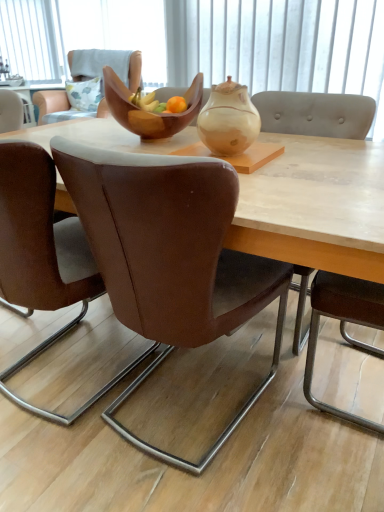
In order to face brown leather chair at center, which appears as the 1th chair when viewed from the back, should I rotate leftwards or rightwards?

Turn left by 13.414 degrees to look at brown leather chair at center, which appears as the 1th chair when viewed from the back.

Locate an element on the screen. brown leather chair at center, the 4th chair viewed from the front is located at coordinates (107, 64).

The width and height of the screenshot is (384, 512). Describe the element at coordinates (43, 257) in the screenshot. I see `brown leather chair at center, which is the 2th chair from back to front` at that location.

You are a GUI agent. You are given a task and a screenshot of the screen. Output one action in this format:
    pyautogui.click(x=<x>, y=<y>)
    Task: Click on the wooden bowl at center
    
    Given the screenshot: What is the action you would take?
    pyautogui.click(x=151, y=112)

This screenshot has width=384, height=512. What do you see at coordinates (84, 94) in the screenshot?
I see `fluffy fabric pillow at upper left` at bounding box center [84, 94].

What is the approximate height of brown leather chair at center, marked as the first chair in a front-to-back arrangement?

36.78 inches.

Locate an element on the screen. brown leather chair at center, which appears as the 1th chair when viewed from the back is located at coordinates (107, 64).

Could you tell me if light gray fabric chair at right, the 3th chair when ordered from back to front, is turned towards wooden bowl at center?

Yes, light gray fabric chair at right, the 3th chair when ordered from back to front, is facing wooden bowl at center.

From the image's perspective, which object appears higher, light gray fabric chair at right, which appears as the 2th chair when viewed from the front, or wooden bowl at center?

wooden bowl at center.

Considering the sizes of objects light gray fabric chair at right, which appears as the 2th chair when viewed from the front, and wooden bowl at center in the image provided, who is thinner, light gray fabric chair at right, which appears as the 2th chair when viewed from the front, or wooden bowl at center?

light gray fabric chair at right, which appears as the 2th chair when viewed from the front, is thinner.

Which object is positioned more to the left, light gray fabric chair at right, the 3th chair when ordered from back to front, or wooden bowl at center?

wooden bowl at center.

How different are the orientations of brown leather chair at center, marked as the first chair in a front-to-back arrangement, and wooden bowl at center in degrees?

brown leather chair at center, marked as the first chair in a front-to-back arrangement, and wooden bowl at center are facing 178 degrees away from each other.

In the scene shown: Is brown leather chair at center, acting as the 4th chair starting from the back, bigger than wooden bowl at center?

No.

In the scene shown: Which is more to the right, brown leather chair at center, acting as the 4th chair starting from the back, or wooden bowl at center?

From the viewer's perspective, brown leather chair at center, acting as the 4th chair starting from the back, appears more on the right side.

Looking at this image, in the image, is brown leather chair at center, marked as the first chair in a front-to-back arrangement, positioned in front of or behind wooden bowl at center?

Clearly, brown leather chair at center, marked as the first chair in a front-to-back arrangement, is behind wooden bowl at center.

Visually, is matte beige teapot at center positioned to the left or to the right of brown leather chair at center, acting as the 4th chair starting from the back?

In the image, matte beige teapot at center appears on the right side of brown leather chair at center, acting as the 4th chair starting from the back.

Is matte beige teapot at center directly adjacent to brown leather chair at center, acting as the 4th chair starting from the back?

No, matte beige teapot at center is not in contact with brown leather chair at center, acting as the 4th chair starting from the back.

Is matte beige teapot at center looking in the opposite direction of brown leather chair at center, acting as the 4th chair starting from the back?

No, matte beige teapot at center's orientation is not away from brown leather chair at center, acting as the 4th chair starting from the back.

Is point (249, 145) positioned behind point (98, 185)?

Yes, point (249, 145) is behind point (98, 185).

Looking at this image, between white fabric at upper center and brown leather chair at center, marked as the first chair in a front-to-back arrangement, which one has smaller width?

Thinner between the two is white fabric at upper center.

Is white fabric at upper center turned away from brown leather chair at center, marked as the first chair in a front-to-back arrangement?

No, white fabric at upper center is not facing the opposite direction of brown leather chair at center, marked as the first chair in a front-to-back arrangement.

Which is more to the left, white fabric at upper center or brown leather chair at center, marked as the first chair in a front-to-back arrangement?

From the viewer's perspective, white fabric at upper center appears more on the left side.

From the picture: From a real-world perspective, is white fabric at upper center positioned under brown leather chair at center, marked as the first chair in a front-to-back arrangement, based on gravity?

No, from a real-world perspective, white fabric at upper center is not below brown leather chair at center, marked as the first chair in a front-to-back arrangement.

Considering the relative positions of brown leather chair at center, which appears as the 1th chair when viewed from the back, and light gray fabric chair at right, which appears as the 2th chair when viewed from the front, in the image provided, is brown leather chair at center, which appears as the 1th chair when viewed from the back, in front of light gray fabric chair at right, which appears as the 2th chair when viewed from the front,?

No, brown leather chair at center, which appears as the 1th chair when viewed from the back, is further to the viewer.

The height and width of the screenshot is (512, 384). In order to click on the 3rd chair counting from the left of the light gray fabric chair at right, the 3th chair when ordered from back to front in this screenshot , I will do `click(107, 64)`.

How different are the orientations of brown leather chair at center, the 4th chair viewed from the front, and light gray fabric chair at right, which appears as the 2th chair when viewed from the front, in degrees?

There is a 93.6-degree angle between the facing directions of brown leather chair at center, the 4th chair viewed from the front, and light gray fabric chair at right, which appears as the 2th chair when viewed from the front.

Is brown leather chair at center, which appears as the 1th chair when viewed from the back, completely or partially outside of light gray fabric chair at right, which appears as the 2th chair when viewed from the front?

Absolutely, brown leather chair at center, which appears as the 1th chair when viewed from the back, is external to light gray fabric chair at right, which appears as the 2th chair when viewed from the front.

Would you say wooden bowl at center is outside white fabric at upper center?

Yes, wooden bowl at center is not within white fabric at upper center.

Based on the photo, considering the sizes of objects wooden bowl at center and white fabric at upper center in the image provided, who is thinner, wooden bowl at center or white fabric at upper center?

With smaller width is white fabric at upper center.

Which point is more forward, (x=126, y=108) or (x=20, y=6)?

The point (x=126, y=108) is closer to the camera.

Based on the photo, is wooden bowl at center taller than white fabric at upper center?

In fact, wooden bowl at center may be shorter than white fabric at upper center.

Which is nearer, (229, 78) or (2, 18)?

Clearly, point (229, 78) is closer to the camera than point (2, 18).

Is the depth of matte beige teapot at center greater than that of white fabric at upper center?

No, it is in front of white fabric at upper center.

From the image's perspective, is matte beige teapot at center under white fabric at upper center?

Yes, from the image's perspective, matte beige teapot at center is beneath white fabric at upper center.

Is matte beige teapot at center facing towards white fabric at upper center?

No.

Locate an element on the screen. The image size is (384, 512). the 2nd chair behind the wooden bowl at center, starting your count from the anchor is located at coordinates (315, 114).

I want to click on the 1st chair to the right of the wooden bowl at center, starting your count from the anchor, so click(170, 258).

When comparing their distances from wooden bowl at center, does brown leather chair at center, which is the 2th chair from back to front, or matte beige teapot at center seem closer?

matte beige teapot at center lies closer to wooden bowl at center than the other object.

When comparing their distances from fluffy fabric pillow at upper left, does light gray fabric chair at right, the 3th chair when ordered from back to front, or brown leather chair at center, which is the 2th chair from back to front, seem closer?

light gray fabric chair at right, the 3th chair when ordered from back to front, is closer to fluffy fabric pillow at upper left.

When comparing their distances from wooden bowl at center, does fluffy fabric pillow at upper left or brown leather chair at center, which is the 2th chair from back to front, seem closer?

Among the two, brown leather chair at center, which is the 2th chair from back to front, is located nearer to wooden bowl at center.

Considering their positions, is fluffy fabric pillow at upper left positioned further to brown leather chair at center, which is the 2th chair from back to front, than wooden bowl at center?

The object further to brown leather chair at center, which is the 2th chair from back to front, is fluffy fabric pillow at upper left.

When comparing their distances from light gray fabric chair at right, the 3th chair when ordered from back to front, does matte beige teapot at center or brown leather chair at center, marked as the first chair in a front-to-back arrangement, seem closer?

matte beige teapot at center.

From the image, which object appears to be farther from light gray fabric chair at right, which appears as the 2th chair when viewed from the front, fluffy fabric pillow at upper left or wooden bowl at center?

fluffy fabric pillow at upper left lies further to light gray fabric chair at right, which appears as the 2th chair when viewed from the front, than the other object.

Estimate the real-world distances between objects in this image. Which object is closer to white fabric at upper center, wooden bowl at center or matte beige teapot at center?

wooden bowl at center is closer to white fabric at upper center.

Based on their spatial positions, is brown leather chair at center, the 4th chair viewed from the front, or white fabric at upper center closer to brown leather chair at center, arranged as the 3th chair when viewed from the front?

The object closer to brown leather chair at center, arranged as the 3th chair when viewed from the front, is brown leather chair at center, the 4th chair viewed from the front.

Locate an element on the screen. Image resolution: width=384 pixels, height=512 pixels. bowl located between wooden bowl at center and white fabric at upper center in the depth direction is located at coordinates (151, 112).

You are a GUI agent. You are given a task and a screenshot of the screen. Output one action in this format:
    pyautogui.click(x=<x>, y=<y>)
    Task: Click on the chair situated between wooden bowl at center and light gray fabric chair at right, the 3th chair when ordered from back to front, from left to right
    This screenshot has width=384, height=512.
    Given the screenshot: What is the action you would take?
    pyautogui.click(x=170, y=258)

Image resolution: width=384 pixels, height=512 pixels. Identify the location of tea pot between wooden bowl at center and brown leather chair at center, arranged as the 3th chair when viewed from the front, in the up-down direction. (228, 119).

The height and width of the screenshot is (512, 384). What are the coordinates of `chair between brown leather chair at center, arranged as the 3th chair when viewed from the front, and fluffy fabric pillow at upper left from front to back` in the screenshot? It's located at (107, 64).